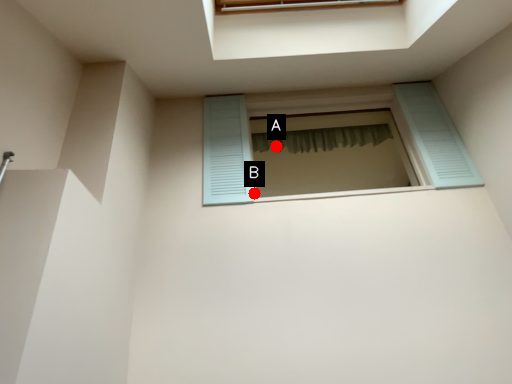
Question: Two points are circled on the image, labeled by A and B beside each circle. Among these points, which one is farthest from the camera?

Choices:
 (A) A is further
 (B) B is further

Answer: (A)